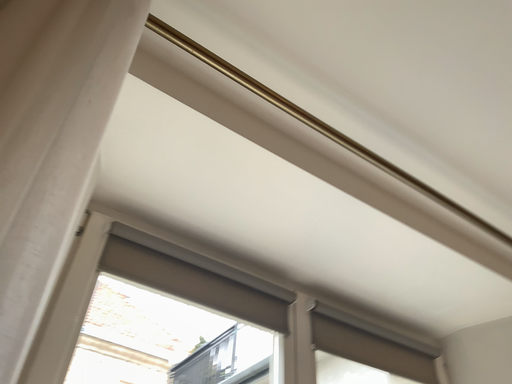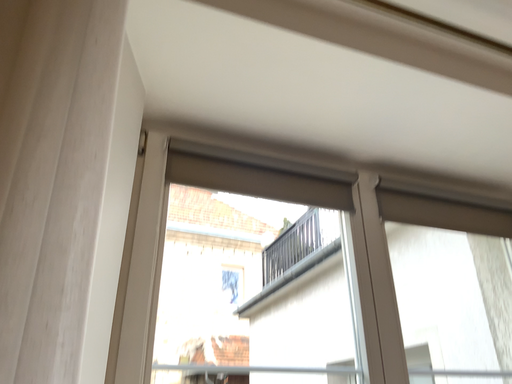
Question: Which way did the camera rotate in the video?

Choices:
 (A) rotated left
 (B) rotated right

Answer: (A)